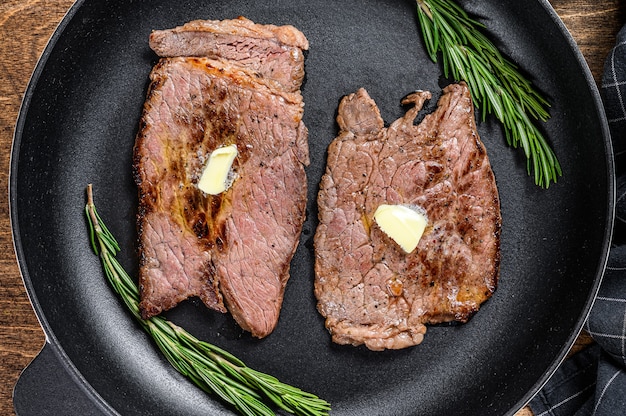
The width and height of the screenshot is (626, 416). What are the coordinates of `dark wood table surface` in the screenshot? It's located at (590, 23), (24, 27).